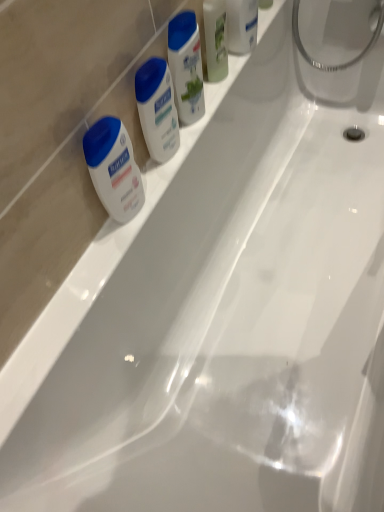
Question: Which direction should I rotate to look at white glossy lotion at upper center, acting as the 2th toiletry starting from the top, — up or down?

Choices:
 (A) up
 (B) down

Answer: (A)

Question: From the image's perspective, is translucent plastic soap at upper right, which appears as the fourth toiletry when ordered from the bottom, above white matte lotion at left?

Choices:
 (A) no
 (B) yes

Answer: (B)

Question: Is translucent plastic soap at upper right, marked as the 1th toiletry in a top-to-bottom arrangement, bigger than white matte lotion at left?

Choices:
 (A) yes
 (B) no

Answer: (B)

Question: Is translucent plastic soap at upper right, marked as the 1th toiletry in a top-to-bottom arrangement, outside of white matte lotion at left?

Choices:
 (A) no
 (B) yes

Answer: (B)

Question: From a real-world perspective, is translucent plastic soap at upper right, which appears as the fourth toiletry when ordered from the bottom, located higher than white matte lotion at left?

Choices:
 (A) no
 (B) yes

Answer: (B)

Question: Could you tell me if translucent plastic soap at upper right, marked as the 1th toiletry in a top-to-bottom arrangement, is facing white matte lotion at left?

Choices:
 (A) yes
 (B) no

Answer: (B)

Question: Is translucent plastic soap at upper right, which appears as the fourth toiletry when ordered from the bottom, turned away from white matte lotion at left?

Choices:
 (A) no
 (B) yes

Answer: (A)

Question: Can you confirm if white glossy lotion at upper center, acting as the 2th toiletry starting from the top, is thinner than white matte lotion at left?

Choices:
 (A) no
 (B) yes

Answer: (A)

Question: Is white glossy lotion at upper center, positioned as the third toiletry in bottom-to-top order, in front of white matte lotion at left?

Choices:
 (A) no
 (B) yes

Answer: (A)

Question: Does white glossy lotion at upper center, acting as the 2th toiletry starting from the top, come behind white matte lotion at left?

Choices:
 (A) yes
 (B) no

Answer: (A)

Question: From the image's perspective, would you say white glossy lotion at upper center, positioned as the third toiletry in bottom-to-top order, is shown under white matte lotion at left?

Choices:
 (A) yes
 (B) no

Answer: (B)

Question: Can you confirm if white glossy lotion at upper center, positioned as the third toiletry in bottom-to-top order, is taller than white matte lotion at left?

Choices:
 (A) yes
 (B) no

Answer: (A)

Question: Does white glossy lotion at upper center, positioned as the third toiletry in bottom-to-top order, have a greater width compared to white matte lotion at left?

Choices:
 (A) no
 (B) yes

Answer: (B)

Question: Considering the relative positions of white matte lotion at center, the 4th toiletry viewed from the top, and green matte mouthwash at upper center in the image provided, is white matte lotion at center, the 4th toiletry viewed from the top, to the left of green matte mouthwash at upper center from the viewer's perspective?

Choices:
 (A) yes
 (B) no

Answer: (A)